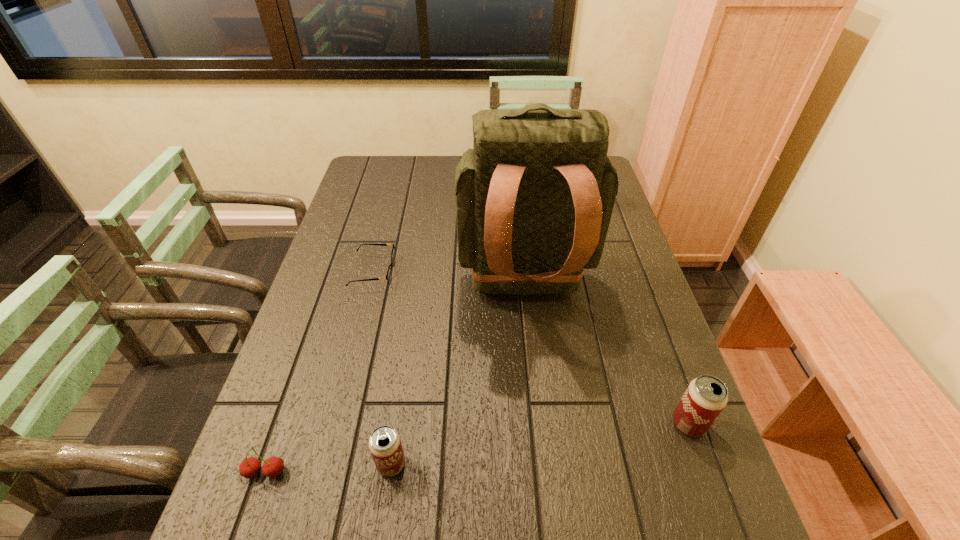
Locate an element on the screen. The image size is (960, 540). free space for an extra beer_can to achieve even spacing is located at coordinates (545, 443).